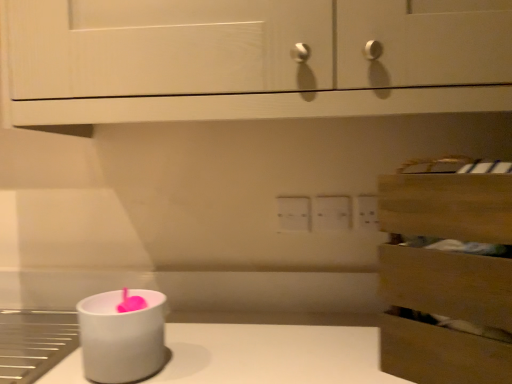
This screenshot has height=384, width=512. What do you see at coordinates (122, 337) in the screenshot? I see `white matte candle holder at lower left` at bounding box center [122, 337].

This screenshot has width=512, height=384. I want to click on white wood cabinet at upper center, so click(252, 59).

Is white plastic electric outlet at center looking in the opposite direction of white matte candle holder at lower left?

No.

From a real-world perspective, which is physically above, white plastic electric outlet at center or white matte candle holder at lower left?

white plastic electric outlet at center is physically above.

From their relative heights in the image, would you say white plastic electric outlet at center is taller or shorter than white matte candle holder at lower left?

Considering their sizes, white plastic electric outlet at center has less height than white matte candle holder at lower left.

Which is more to the left, white plastic electric outlet at center or white matte candle holder at lower left?

From the viewer's perspective, white matte candle holder at lower left appears more on the left side.

How much distance is there between white matte candle holder at lower left and wooden drawer at right?

white matte candle holder at lower left and wooden drawer at right are 18.67 inches apart.

Is white matte candle holder at lower left not near wooden drawer at right?

No, white matte candle holder at lower left is in close proximity to wooden drawer at right.

Could you tell me if white matte candle holder at lower left is facing wooden drawer at right?

No, white matte candle holder at lower left does not turn towards wooden drawer at right.

Between point (133, 375) and point (417, 224), which one is positioned in front?

The point (417, 224) is closer to the camera.

At what (x,y) coordinates should I click in order to perform the action: click on drawer that appears in front of the white plastic electric outlet at center. Please return your answer as a coordinate pair (x, y). This screenshot has width=512, height=384. Looking at the image, I should click on (447, 252).

Based on their sizes in the image, would you say wooden drawer at right is bigger or smaller than white plastic electric outlet at center?

Considering their sizes, wooden drawer at right takes up more space than white plastic electric outlet at center.

Between wooden drawer at right and white plastic electric outlet at center, which one has more height?

wooden drawer at right.

Is wooden drawer at right aimed at white plastic electric outlet at center?

No.

Is wooden drawer at right taller or shorter than white wood cabinet at upper center?

Clearly, wooden drawer at right is shorter compared to white wood cabinet at upper center.

Based on the photo, is the depth of wooden drawer at right greater than that of white wood cabinet at upper center?

That is False.

In the scene shown: From a real-world perspective, is wooden drawer at right located beneath white wood cabinet at upper center?

Yes, from a real-world perspective, wooden drawer at right is below white wood cabinet at upper center.

Do you think white wood cabinet at upper center is within white matte candle holder at lower left, or outside of it?

white wood cabinet at upper center cannot be found inside white matte candle holder at lower left.

From a real-world perspective, is white wood cabinet at upper center physically located above or below white matte candle holder at lower left?

white wood cabinet at upper center is situated higher than white matte candle holder at lower left in the real world.

The width and height of the screenshot is (512, 384). What are the coordinates of `candle holder on the left of white wood cabinet at upper center` in the screenshot? It's located at (122, 337).

Can you confirm if white plastic electric outlet at center is shorter than wooden drawer at right?

Yes.

Identify the location of drawer that appears below the white plastic electric outlet at center (from a real-world perspective). click(447, 252).

Is white plastic electric outlet at center aimed at wooden drawer at right?

No.

Is wooden drawer at right with white matte candle holder at lower left?

No, wooden drawer at right is not next to white matte candle holder at lower left.

Considering the relative sizes of wooden drawer at right and white matte candle holder at lower left in the image provided, is wooden drawer at right wider than white matte candle holder at lower left?

Indeed, wooden drawer at right has a greater width compared to white matte candle holder at lower left.

Between wooden drawer at right and white matte candle holder at lower left, which one has less height?

white matte candle holder at lower left.

Is wooden drawer at right smaller than white matte candle holder at lower left?

No.

Locate an element on the screen. candle holder on the left side of white plastic electric outlet at center is located at coordinates (122, 337).

The width and height of the screenshot is (512, 384). Find the location of `drawer above the white matte candle holder at lower left (from the image's perspective)`. drawer above the white matte candle holder at lower left (from the image's perspective) is located at coordinates (447, 252).

Based on their spatial positions, is white plastic electric outlet at center or white matte candle holder at lower left closer to wooden drawer at right?

white plastic electric outlet at center is positioned closer to the anchor wooden drawer at right.

Looking at the image, which one is located closer to white plastic electric outlet at center, white matte candle holder at lower left or white wood cabinet at upper center?

Based on the image, white wood cabinet at upper center appears to be nearer to white plastic electric outlet at center.

From the image, which object appears to be nearer to white wood cabinet at upper center, wooden drawer at right or white plastic electric outlet at center?

wooden drawer at right.

Which object lies further to the anchor point white matte candle holder at lower left, wooden drawer at right or white plastic electric outlet at center?

Among the two, white plastic electric outlet at center is located further to white matte candle holder at lower left.

From the image, which object appears to be farther from white plastic electric outlet at center, wooden drawer at right or white matte candle holder at lower left?

The object further to white plastic electric outlet at center is white matte candle holder at lower left.

Considering their positions, is wooden drawer at right positioned further to white plastic electric outlet at center than white wood cabinet at upper center?

Among the two, white wood cabinet at upper center is located further to white plastic electric outlet at center.

Looking at the image, which one is located closer to white matte candle holder at lower left, white plastic electric outlet at center or white wood cabinet at upper center?

white wood cabinet at upper center is positioned closer to the anchor white matte candle holder at lower left.

Which object lies nearer to the anchor point wooden drawer at right, white wood cabinet at upper center or white plastic electric outlet at center?

Among the two, white wood cabinet at upper center is located nearer to wooden drawer at right.

This screenshot has width=512, height=384. I want to click on electric outlet situated between white matte candle holder at lower left and wooden drawer at right from left to right, so click(x=332, y=213).

This screenshot has height=384, width=512. I want to click on electric outlet that lies between white wood cabinet at upper center and white matte candle holder at lower left from top to bottom, so click(332, 213).

I want to click on cabinetry situated between white matte candle holder at lower left and wooden drawer at right from left to right, so click(x=252, y=59).

You are a GUI agent. You are given a task and a screenshot of the screen. Output one action in this format:
    pyautogui.click(x=<x>, y=<y>)
    Task: Click on the cabinetry located between wooden drawer at right and white plastic electric outlet at center in the depth direction
    The width and height of the screenshot is (512, 384).
    Given the screenshot: What is the action you would take?
    [252, 59]